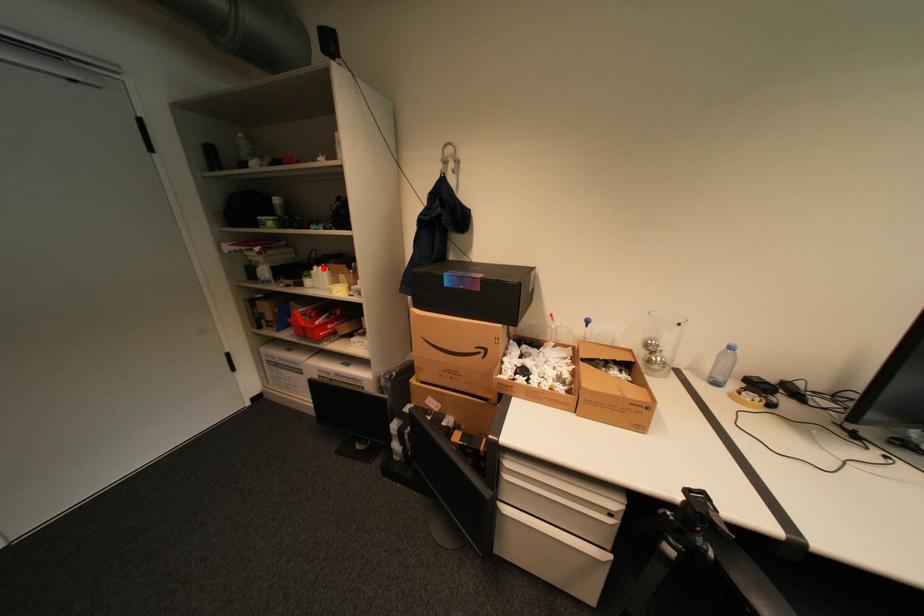
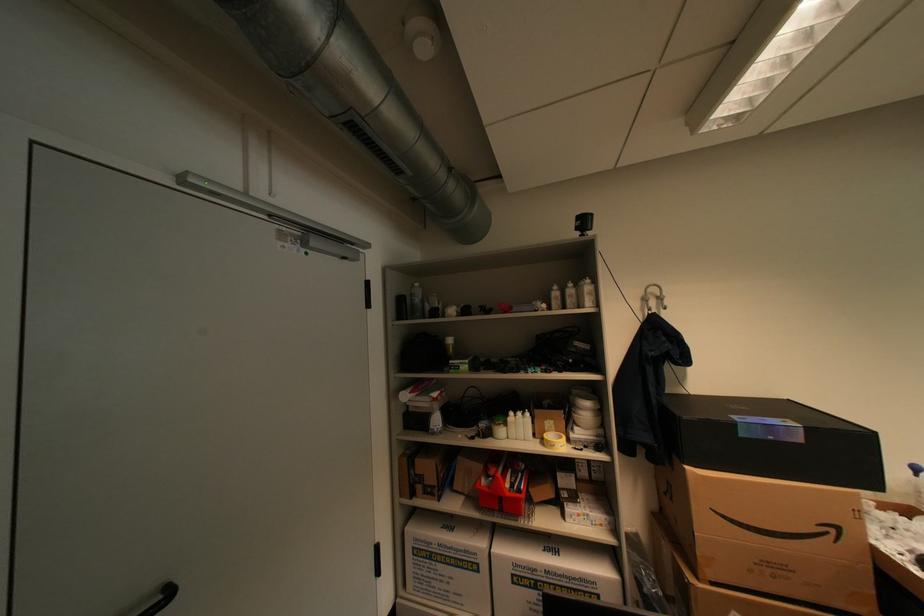
Question: I am providing you with two images of the same scene from different viewpoints. In image1, a red point is highlighted. Considering the same 3D point in image2, which of the following is correct?

Choices:
 (A) It is closer
 (B) It is farther

Answer: (B)